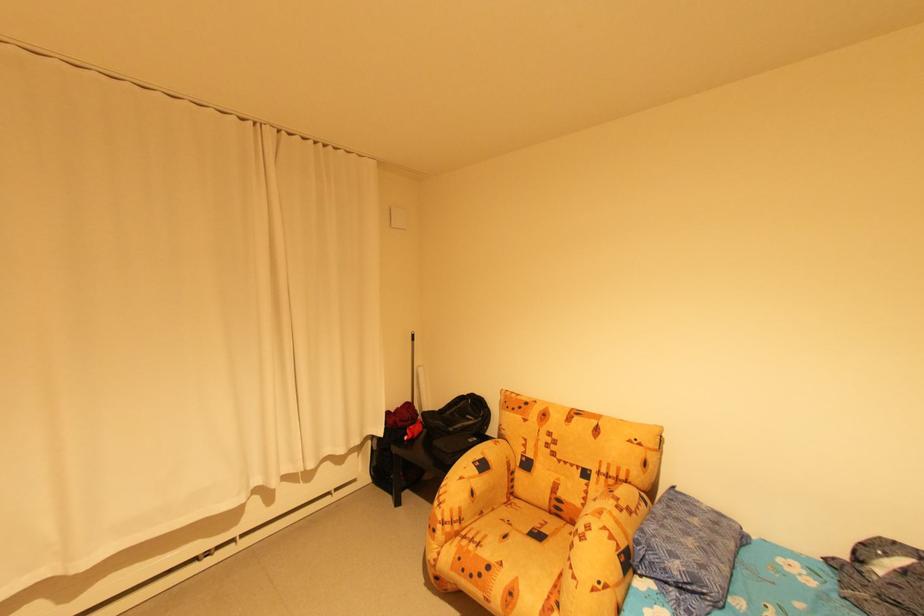
This screenshot has width=924, height=616. What are the coordinates of `blue patterned pillow` in the screenshot? It's located at (687, 552).